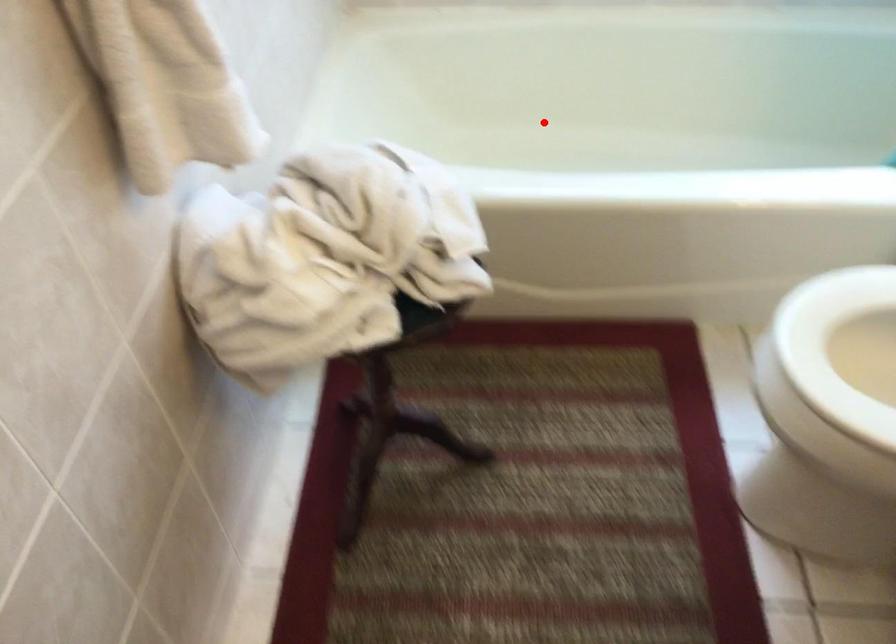
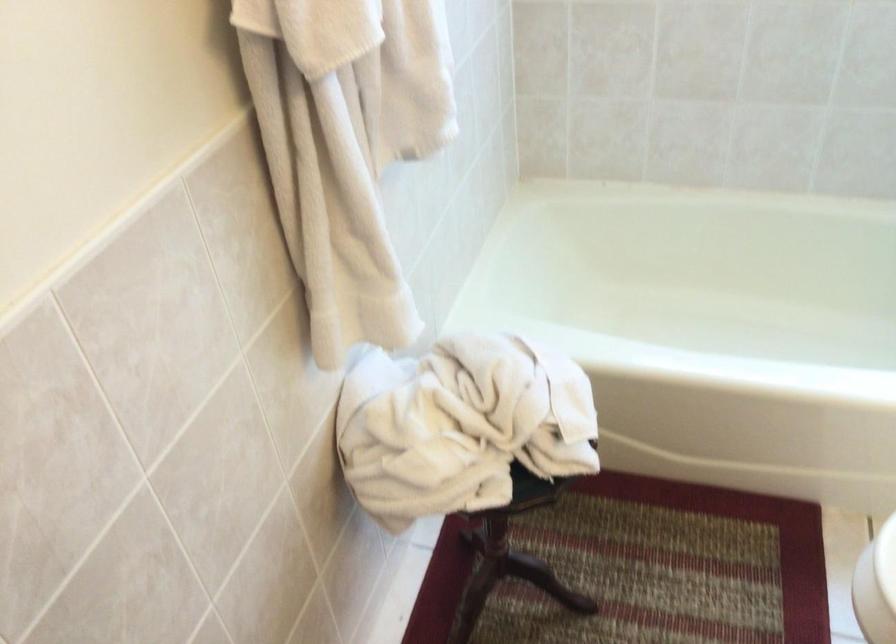
In the second image, find the point that corresponds to the highlighted location in the first image.

(698, 283)